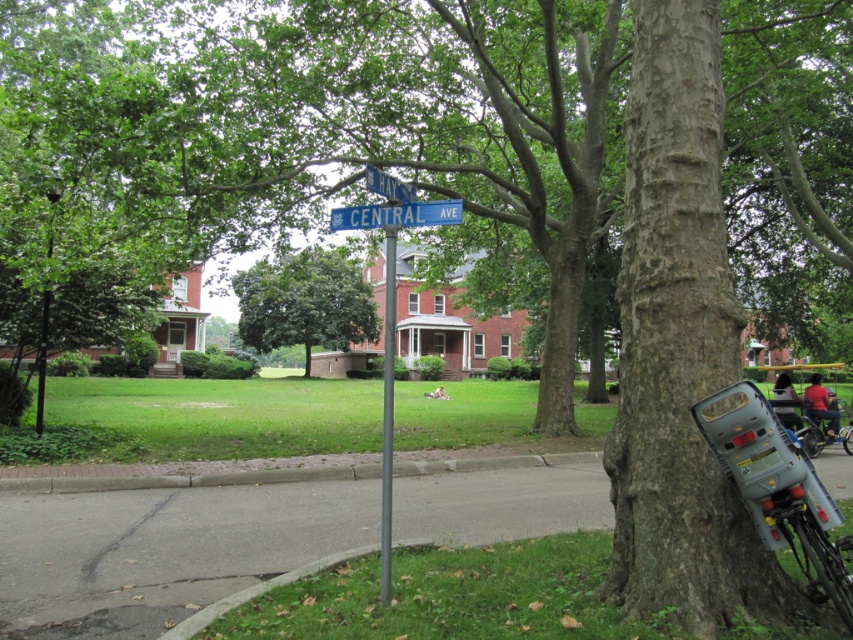
You are a pedestrian standing at the intersection and see the metallic pole at center and the black metal pole at upper left. Which pole is closer to the right side of the road?

The metallic pole at center is closer to the right side of the road because it is positioned to the right of the black metal pole at upper left.

You are a city planner inspecting the street layout. You need to determine if the black metal pole at upper left can support a heavier sign than the blue plastic street sign at upper center currently holds. Based on the scene, what can you infer?

The black metal pole at upper left has a larger size compared to the blue plastic street sign at upper center, which suggests it can support a heavier sign.